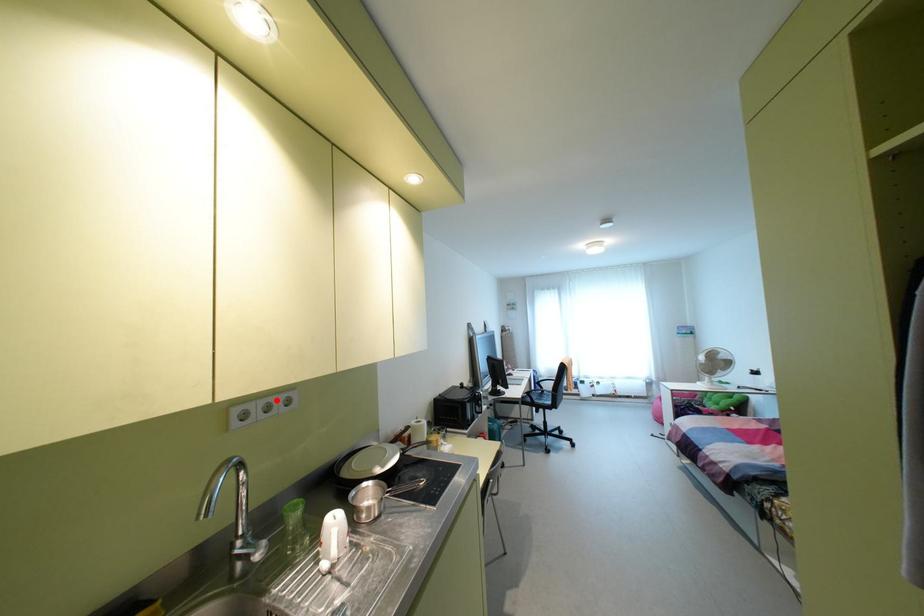
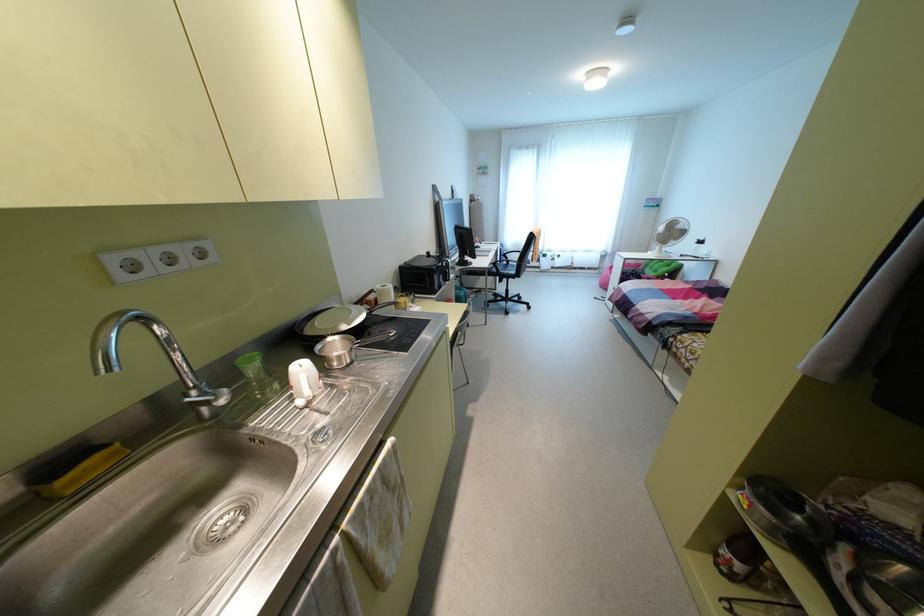
In the second image, find the point that corresponds to the highlighted location in the first image.

(181, 251)